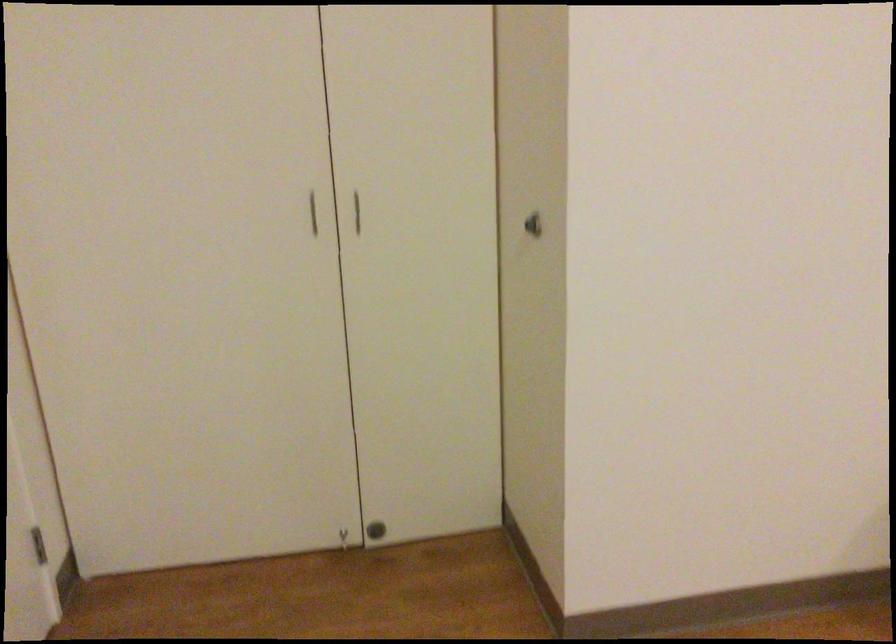
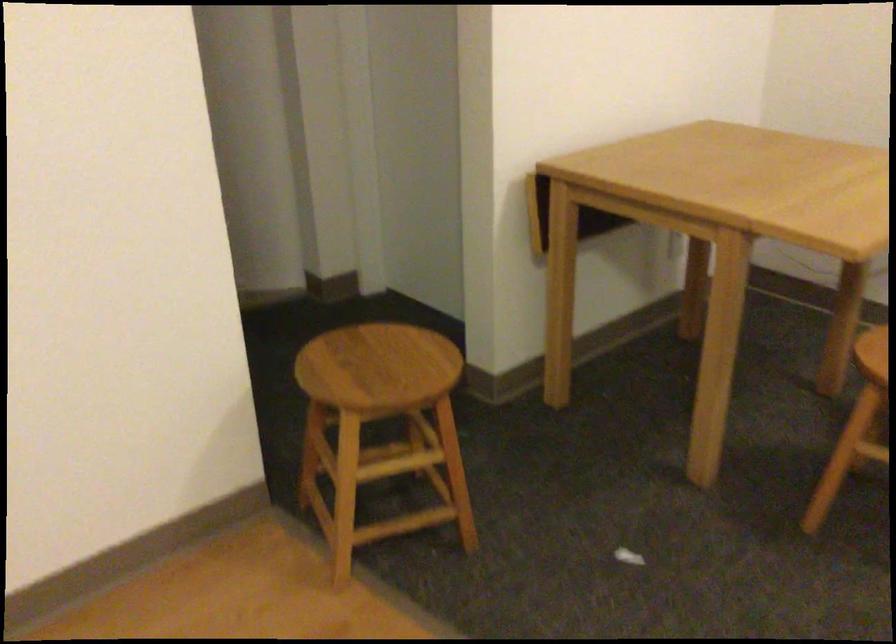
Question: Based on the continuous images, in which direction is the camera rotating? Reply with the corresponding letter.

Choices:
 (A) Left
 (B) Right
 (C) Up
 (D) Down

Answer: (B)